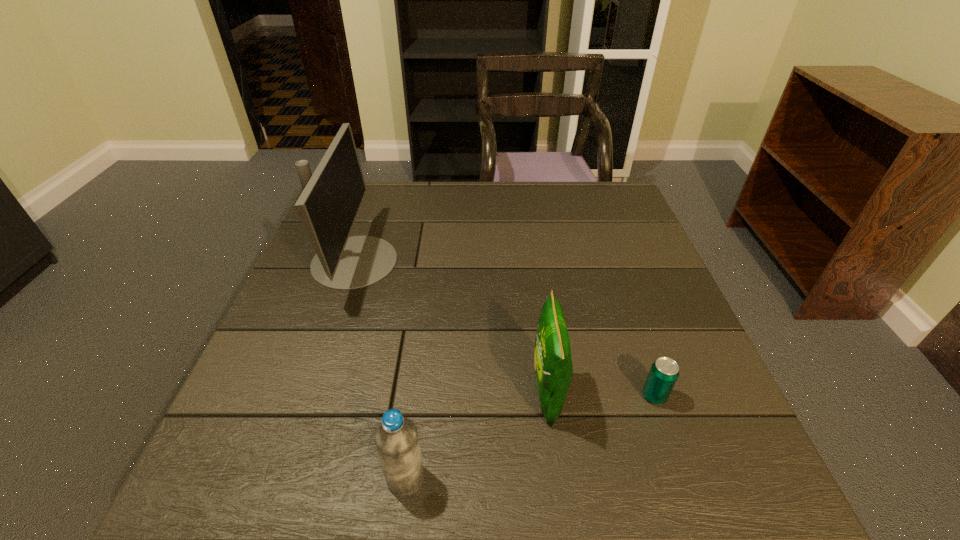
Where is `free space at the left edge of the desktop`? The width and height of the screenshot is (960, 540). free space at the left edge of the desktop is located at coordinates (272, 374).

Identify the location of vacant space at the right edge. The height and width of the screenshot is (540, 960). (675, 292).

Where is `vacant space at the far left corner`? vacant space at the far left corner is located at coordinates (378, 187).

Where is `blank space at the far right corner of the desktop`? Image resolution: width=960 pixels, height=540 pixels. blank space at the far right corner of the desktop is located at coordinates (612, 191).

At what (x,y) coordinates should I click in order to perform the action: click on vacant area between the nearest object and the third object from left to right. Please return your answer as a coordinate pair (x, y). Looking at the image, I should click on (476, 436).

At what (x,y) coordinates should I click in order to perform the action: click on blank region between the shortest object and the farthest object. Please return your answer as a coordinate pair (x, y). The image size is (960, 540). Looking at the image, I should click on (504, 329).

This screenshot has height=540, width=960. I want to click on vacant space that's between the crisp (potato chip) and the nearest object, so click(x=476, y=436).

At what (x,y) coordinates should I click in order to perform the action: click on free spot between the rightmost object and the water bottle. Please return your answer as a coordinate pair (x, y). This screenshot has height=540, width=960. Looking at the image, I should click on (530, 437).

Find the location of a particular element. The height and width of the screenshot is (540, 960). free space between the water bottle and the second object from right to left is located at coordinates (476, 436).

Identify the location of free space between the third object from right to left and the tallest object. Image resolution: width=960 pixels, height=540 pixels. (380, 370).